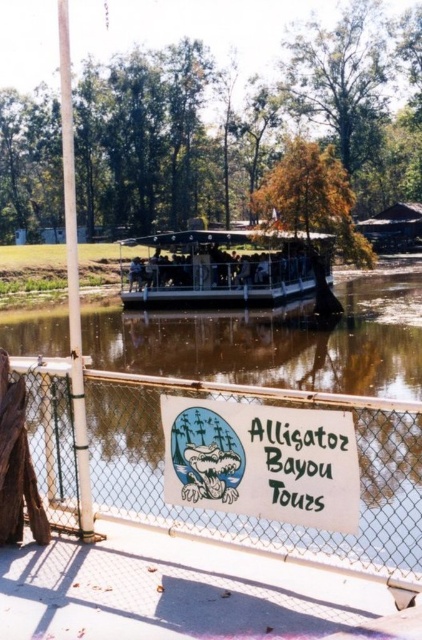
Question: Which object is positioned closest to the white chain-link fence at center?

Choices:
 (A) white paper sign at center
 (B) white plastic boat at center

Answer: (A)

Question: Which point is farther from the camera taking this photo?

Choices:
 (A) (411, 536)
 (B) (300, 244)

Answer: (B)

Question: Can you confirm if white paper sign at center is smaller than white plastic boat at center?

Choices:
 (A) yes
 (B) no

Answer: (A)

Question: Observing the image, what is the correct spatial positioning of white paper sign at center in reference to white plastic boat at center?

Choices:
 (A) above
 (B) below

Answer: (B)

Question: Is white chain-link fence at center thinner than white paper sign at center?

Choices:
 (A) yes
 (B) no

Answer: (B)

Question: Among these objects, which one is nearest to the camera?

Choices:
 (A) white paper sign at center
 (B) white plastic boat at center
 (C) white chain-link fence at center

Answer: (C)